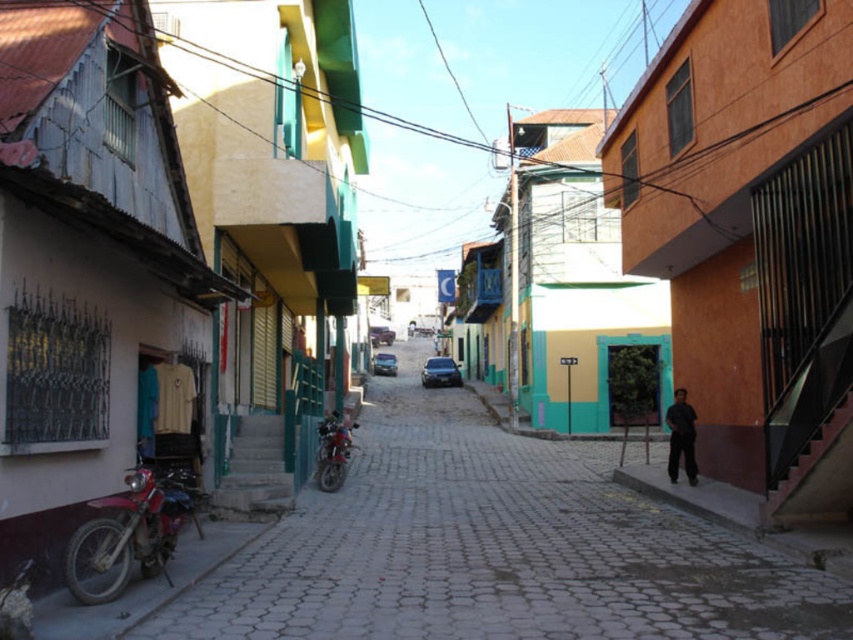
Is metallic red motorcycle at center shorter than dark gray fabric pants at lower right?

Correct, metallic red motorcycle at center is not as tall as dark gray fabric pants at lower right.

Is metallic red motorcycle at center taller than dark gray fabric pants at lower right?

Incorrect, metallic red motorcycle at center's height is not larger of dark gray fabric pants at lower right's.

Which is in front, point (350, 422) or point (689, 412)?

Point (689, 412) is more forward.

Locate an element on the screen. metallic red motorcycle at center is located at coordinates (334, 451).

From the picture: Can you confirm if red matte motorcycle at lower left is wider than dark gray fabric pants at lower right?

Yes, red matte motorcycle at lower left is wider than dark gray fabric pants at lower right.

Is point (146, 564) farther from camera compared to point (691, 472)?

No, it is not.

Is point (173, 497) positioned before point (683, 456)?

Yes, it is.

Find the location of a particular element. red matte motorcycle at lower left is located at coordinates (131, 532).

Does smooth concrete street at center have a greater height compared to red matte motorcycle at lower left?

In fact, smooth concrete street at center may be shorter than red matte motorcycle at lower left.

Is smooth concrete street at center positioned at the back of red matte motorcycle at lower left?

No, smooth concrete street at center is in front of red matte motorcycle at lower left.

Is point (682, 636) positioned in front of point (129, 557)?

Yes, point (682, 636) is closer to viewer.

Find the location of a particular element. This screenshot has height=640, width=853. smooth concrete street at center is located at coordinates (494, 548).